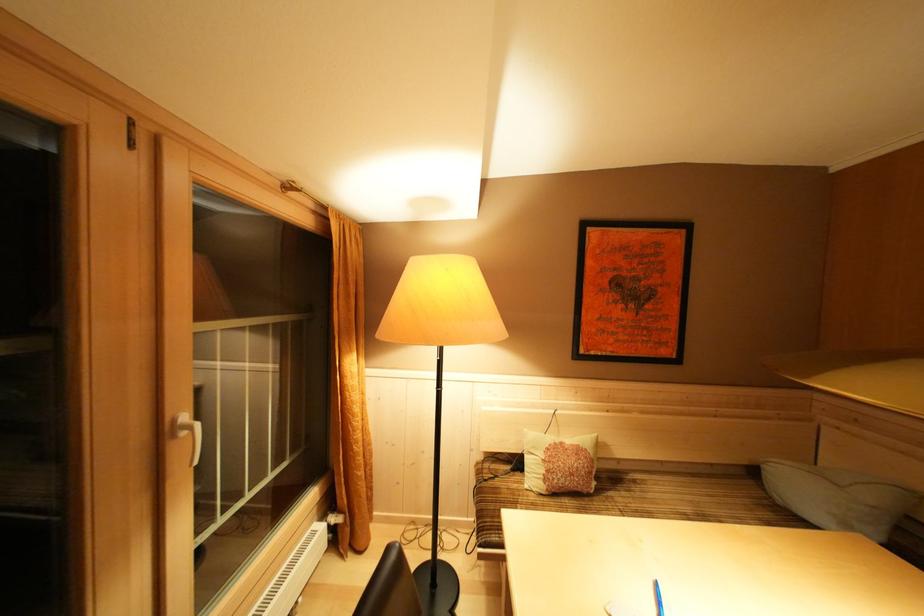
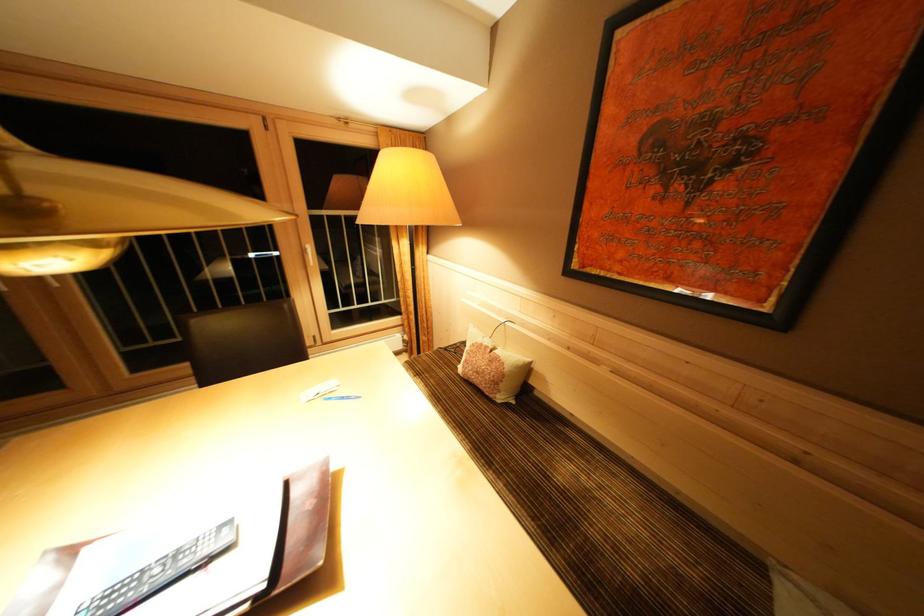
In the second image, find the point that corresponds to (x=169, y=440) in the first image.

(310, 256)